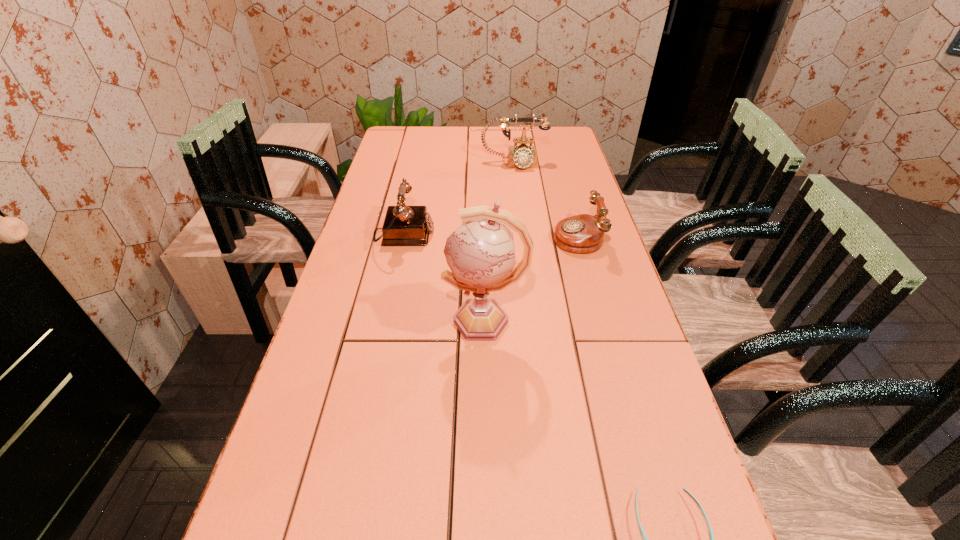
Where is `object that is at the left edge`? object that is at the left edge is located at coordinates (403, 225).

Where is `blank space at the far edge of the desktop`? This screenshot has height=540, width=960. blank space at the far edge of the desktop is located at coordinates (426, 139).

Locate an element on the screen. The height and width of the screenshot is (540, 960). vacant space at the left edge is located at coordinates (331, 408).

This screenshot has height=540, width=960. I want to click on blank space at the right edge of the desktop, so click(578, 289).

Find the location of a particular element. Image resolution: width=960 pixels, height=540 pixels. free location at the far left corner is located at coordinates (425, 132).

In the image, there is a desktop. At what (x,y) coordinates should I click in order to perform the action: click on vacant space at the far right corner. Please return your answer as a coordinate pair (x, y). The width and height of the screenshot is (960, 540). Looking at the image, I should click on (561, 133).

Find the location of a particular element. object that is the closest to the second tallest object is located at coordinates (584, 233).

Identify which object is the nearest to the nearest object. Please provide its 2D coordinates. Your answer should be formatted as a tuple, i.e. [(x, y)], where the tuple contains the x and y coordinates of a point satisfying the conditions above.

[(480, 253)]

Identify which telephone is the second nearest to the leftmost telephone. Please provide its 2D coordinates. Your answer should be formatted as a tuple, i.e. [(x, y)], where the tuple contains the x and y coordinates of a point satisfying the conditions above.

[(584, 233)]

Locate which telephone ranks in proximity to the leftmost object. Please provide its 2D coordinates. Your answer should be formatted as a tuple, i.e. [(x, y)], where the tuple contains the x and y coordinates of a point satisfying the conditions above.

[(522, 156)]